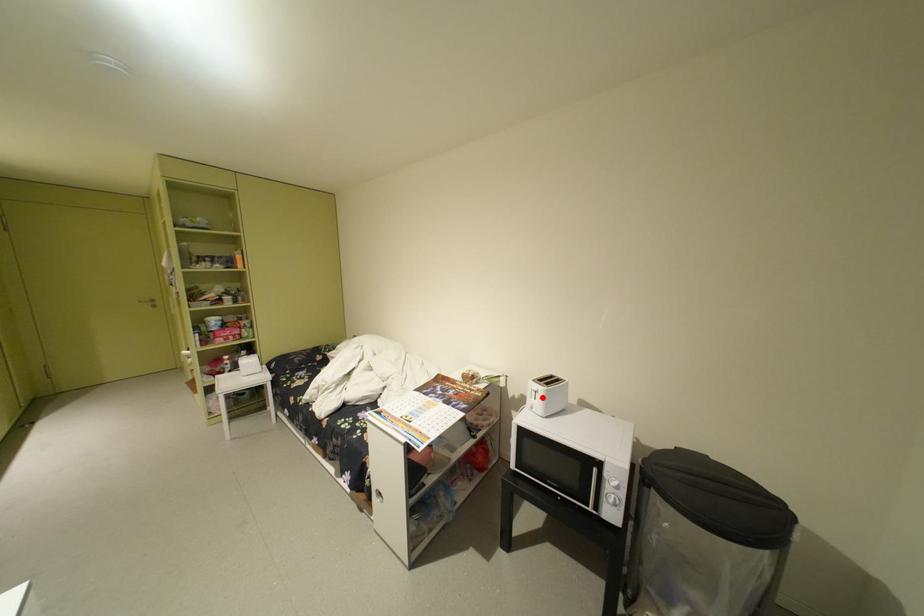
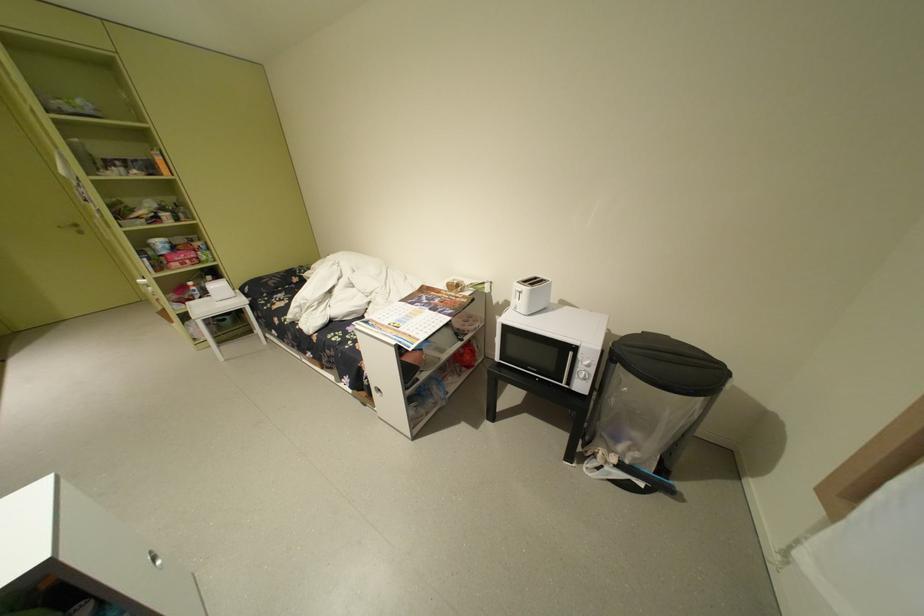
Question: I am providing you with two images of the same scene from different viewpoints. In image1, a red point is highlighted. Considering the same 3D point in image2, which of the following is correct?

Choices:
 (A) It is closer
 (B) It is farther

Answer: (A)